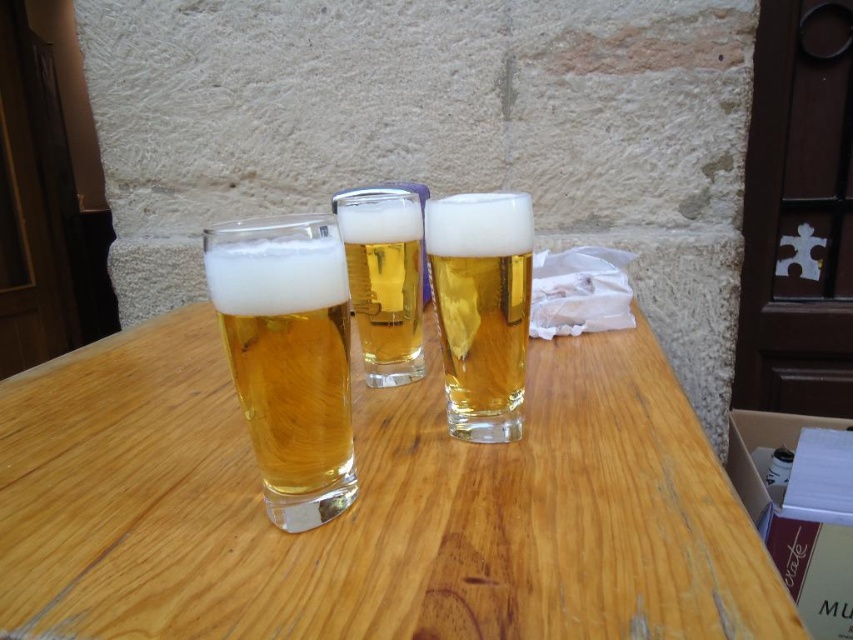
You are at a bar and want to order another beer. The bartender points to the clear glass beer at left located at point (288,356). Which glass should you point to?

The clear glass beer at left is located at point (288,356), so you should point to the glass at that coordinate.

You are a bartender who needs to place a coaster under the clear glass beer at left and the golden glass at center. Since the table is cluttered, you can only place one coaster at a time. Which glass should you place the coaster under first to ensure both glasses are stable?

The clear glass beer at left is positioned under the golden glass at center, so you should place the coaster under the clear glass beer at left first. This ensures that the golden glass at center, which is above it, will also be stabilized when you place the second coaster underneath.

You are a bartender who needs to move the clear glass beer at left and the translucent glass at center to another table. Which glass should you move first to avoid blocking the view of the other?

You should move the clear glass beer at left first because it is in front of the translucent glass at center, so moving it first will prevent blocking the view of the translucent glass at center.